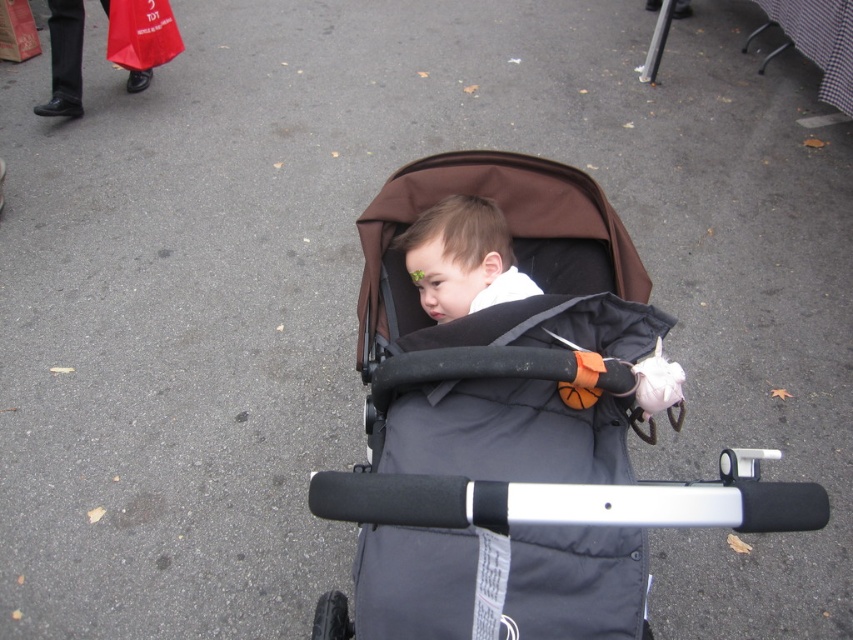
Is black fabric baby carriage at center bigger than matte black toddler at center?

Indeed, black fabric baby carriage at center has a larger size compared to matte black toddler at center.

Can you confirm if black fabric baby carriage at center is shorter than matte black toddler at center?

No.

Is point (421, 637) closer to camera compared to point (404, 250)?

Yes, point (421, 637) is in front of point (404, 250).

The image size is (853, 640). In order to click on black fabric baby carriage at center in this screenshot , I will do `click(518, 428)`.